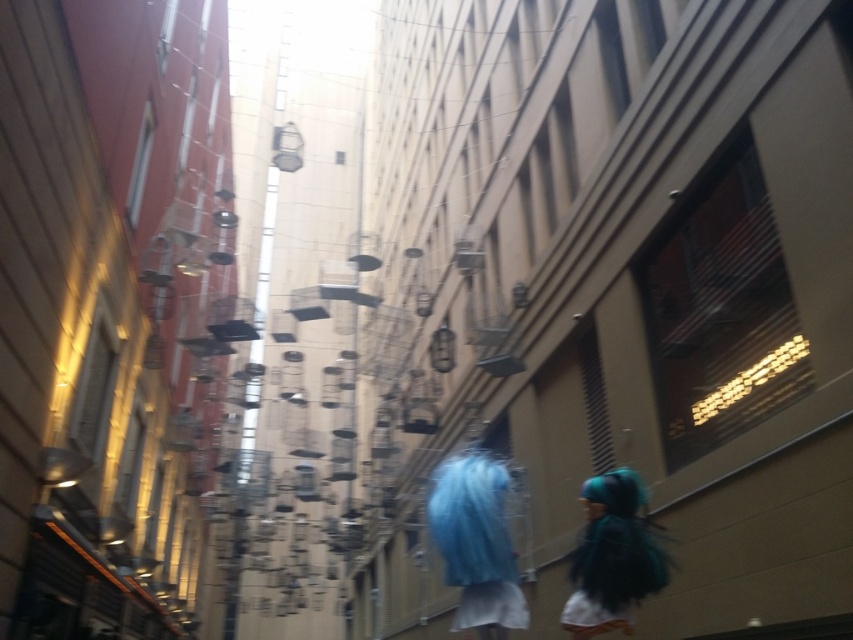
You are a delivery person trying to navigate through the alleyway. You see a blue fuzzy wig at center and a teal matte wig at lower right. Which wig is narrower in width?

The blue fuzzy wig at center has a lesser width compared to the teal matte wig at lower right, so the blue fuzzy wig at center is narrower in width.

You are standing in the alleyway and want to reach a specific location marked by the point at coordinates point (x=474, y=620). If your maximum comfortable walking distance is 12 feet, can you comfortably walk to that point from your current position?

The distance between point (x=474, y=620) and the viewer is 10.98 feet, which is within your maximum comfortable walking distance of 12 feet. Therefore, you can comfortably walk to that point.

You are a window cleaner standing in the alleyway between the red building on the left and the beige building on the right. You see the blue fuzzy wig at center and the teal matte wig at lower right. Which wig is closer to the beige building on the right?

The teal matte wig at lower right is closer to the beige building on the right because it is positioned to the right of the blue fuzzy wig at center.